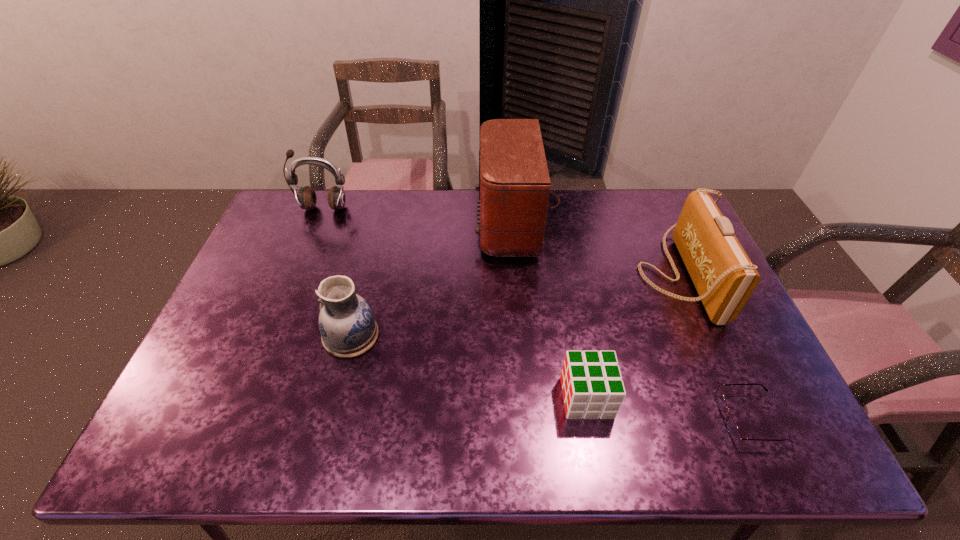
The width and height of the screenshot is (960, 540). In order to click on radio receiver that is at the far edge in this screenshot , I will do `click(514, 184)`.

Where is `earphone positioned at the far edge`? earphone positioned at the far edge is located at coordinates (306, 197).

At what (x,y) coordinates should I click in order to perform the action: click on handbag positioned at the far edge. Please return your answer as a coordinate pair (x, y). Image resolution: width=960 pixels, height=540 pixels. Looking at the image, I should click on (723, 275).

This screenshot has height=540, width=960. Identify the location of object located at the near edge. (732, 428).

You are a GUI agent. You are given a task and a screenshot of the screen. Output one action in this format:
    pyautogui.click(x=<x>, y=<y>)
    Task: Click on the object that is at the left edge
    The image size is (960, 540).
    Given the screenshot: What is the action you would take?
    pyautogui.click(x=306, y=197)

Find the location of a particular element. The height and width of the screenshot is (540, 960). handbag present at the right edge is located at coordinates (723, 275).

Identify the location of spectacles located at the right edge. (x=732, y=428).

The image size is (960, 540). I want to click on object at the far left corner, so click(306, 197).

Find the location of a particular element. object at the far right corner is located at coordinates (723, 275).

Locate an element on the screen. This screenshot has width=960, height=540. object present at the near right corner is located at coordinates (732, 428).